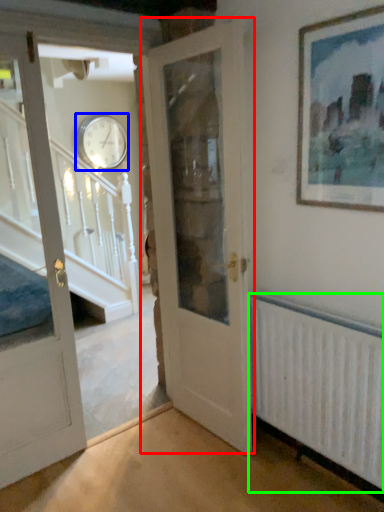
Question: Considering the real-world distances, which object is farthest from door (highlighted by a red box)? clock (highlighted by a blue box) or radiator (highlighted by a green box)?

Choices:
 (A) clock
 (B) radiator

Answer: (A)